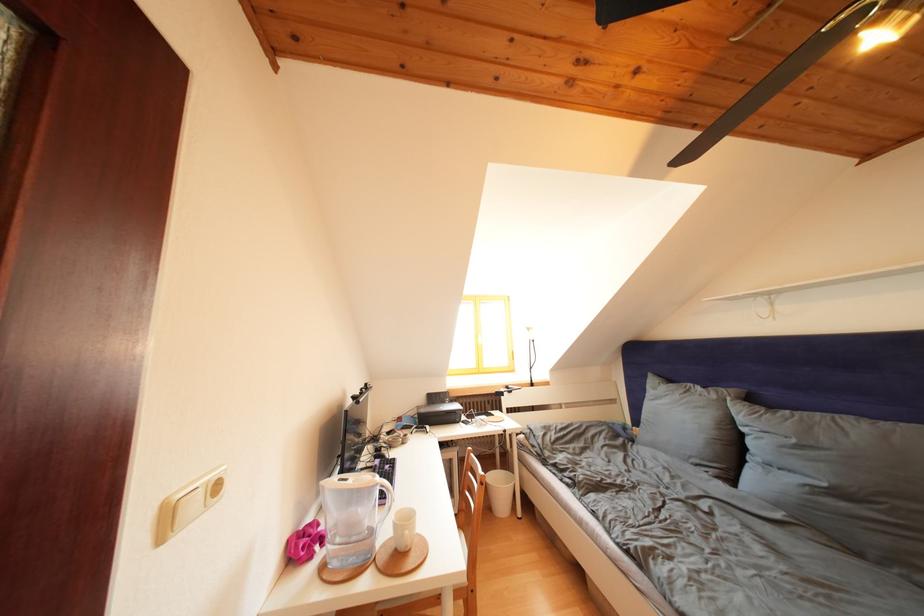
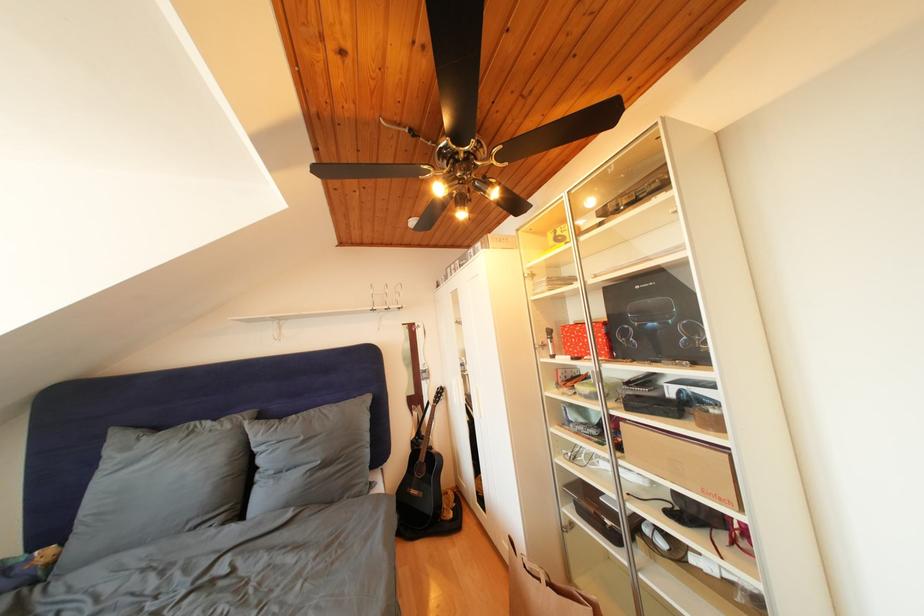
The point at [801,446] is marked in the first image. Where is the corresponding point in the second image?

(310, 444)